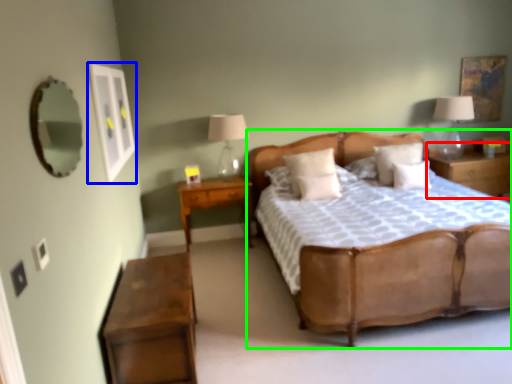
Question: Which object is positioned farthest from nightstand (highlighted by a red box)? Select from picture frame (highlighted by a blue box) and bed (highlighted by a green box).

Choices:
 (A) picture frame
 (B) bed

Answer: (A)